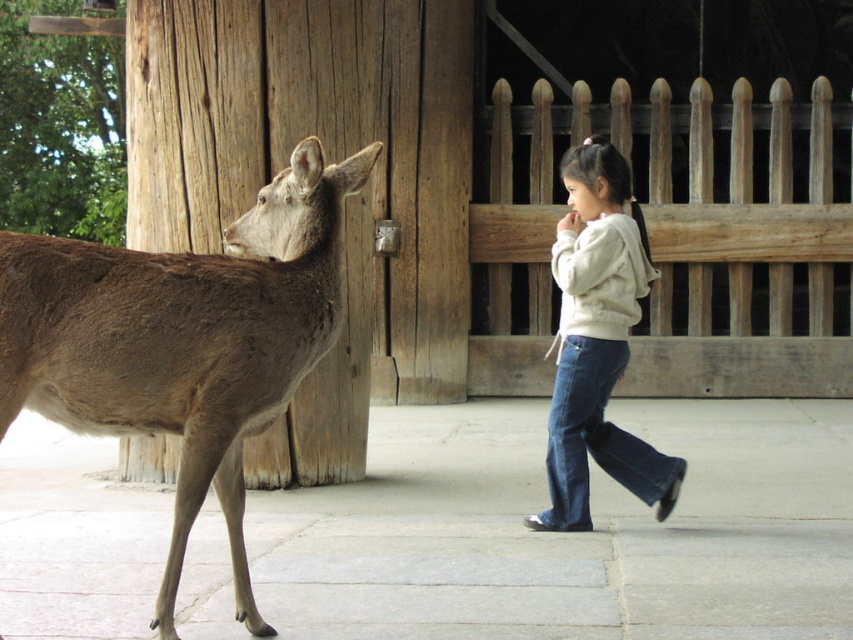
Looking at this image, can you confirm if brown fur deer at left is positioned to the left of denim jeans at lower right?

Yes, brown fur deer at left is to the left of denim jeans at lower right.

Does point (279, 310) come behind point (659, 502)?

No, (279, 310) is in front of (659, 502).

You are a GUI agent. You are given a task and a screenshot of the screen. Output one action in this format:
    pyautogui.click(x=<x>, y=<y>)
    Task: Click on the brown fur deer at left
    This screenshot has width=853, height=640.
    Given the screenshot: What is the action you would take?
    pyautogui.click(x=183, y=340)

Is light beige hoodie at center smaller than denim jeans at lower right?

Actually, light beige hoodie at center might be larger than denim jeans at lower right.

Does light beige hoodie at center come in front of denim jeans at lower right?

Yes, it is in front of denim jeans at lower right.

What do you see at coordinates (596, 342) in the screenshot? The height and width of the screenshot is (640, 853). I see `light beige hoodie at center` at bounding box center [596, 342].

Where is `light beige hoodie at center`? light beige hoodie at center is located at coordinates (596, 342).

Can you confirm if brown fur deer at left is positioned to the left of light beige hoodie at center?

Yes, brown fur deer at left is to the left of light beige hoodie at center.

Who is positioned more to the left, brown fur deer at left or light beige hoodie at center?

brown fur deer at left

Between point (328, 241) and point (577, 372), which one is positioned in front?

Point (328, 241) is more forward.

This screenshot has height=640, width=853. I want to click on brown fur deer at left, so click(183, 340).